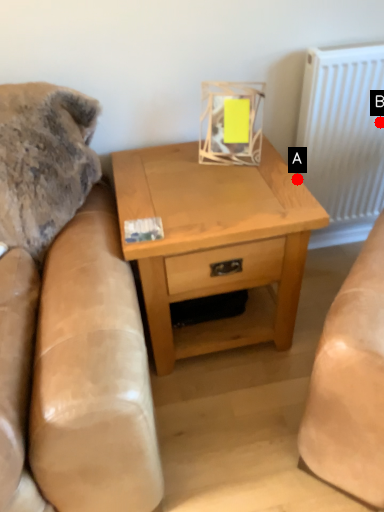
Question: Two points are circled on the image, labeled by A and B beside each circle. Which point is farther from the camera taking this photo?

Choices:
 (A) A is further
 (B) B is further

Answer: (B)